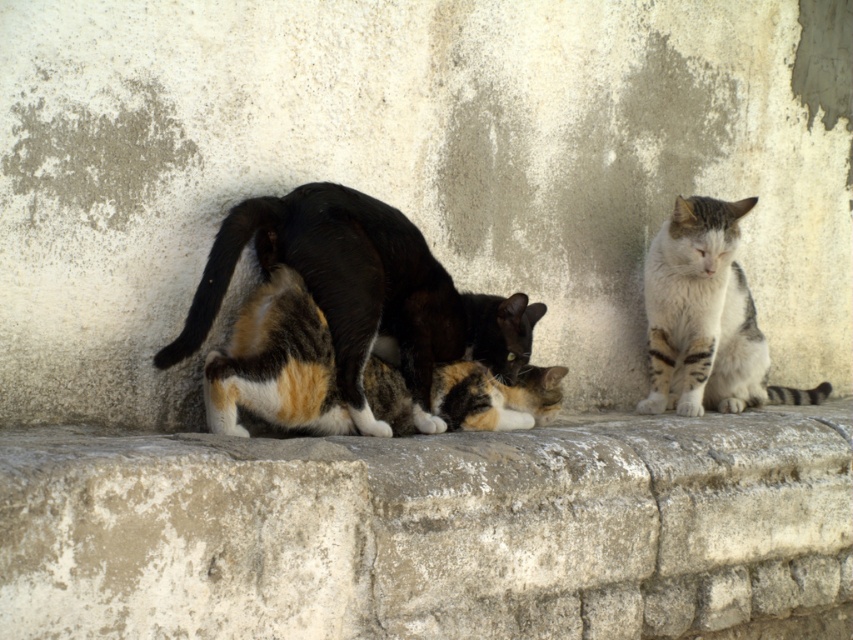
Is gray stone wall at center shorter than striped fur cat at right?

Yes.

Image resolution: width=853 pixels, height=640 pixels. What do you see at coordinates (434, 531) in the screenshot?
I see `gray stone wall at center` at bounding box center [434, 531].

This screenshot has height=640, width=853. What do you see at coordinates (434, 531) in the screenshot?
I see `gray stone wall at center` at bounding box center [434, 531].

At what (x,y) coordinates should I click in order to perform the action: click on gray stone wall at center. Please return your answer as a coordinate pair (x, y). This screenshot has height=640, width=853. Looking at the image, I should click on (434, 531).

Does calico fur cat at center have a lesser height compared to striped fur cat at right?

Yes.

Image resolution: width=853 pixels, height=640 pixels. What do you see at coordinates (363, 291) in the screenshot? I see `calico fur cat at center` at bounding box center [363, 291].

Identify the location of calico fur cat at center. The height and width of the screenshot is (640, 853). (363, 291).

Can you confirm if gray stone wall at center is positioned above calico fur cat at center?

Incorrect, gray stone wall at center is not positioned above calico fur cat at center.

Is point (732, 488) closer to viewer compared to point (369, 234)?

That is False.

Measure the distance between gray stone wall at center and camera.

gray stone wall at center and camera are 2.43 meters apart.

Find the location of a particular element. The width and height of the screenshot is (853, 640). gray stone wall at center is located at coordinates (434, 531).